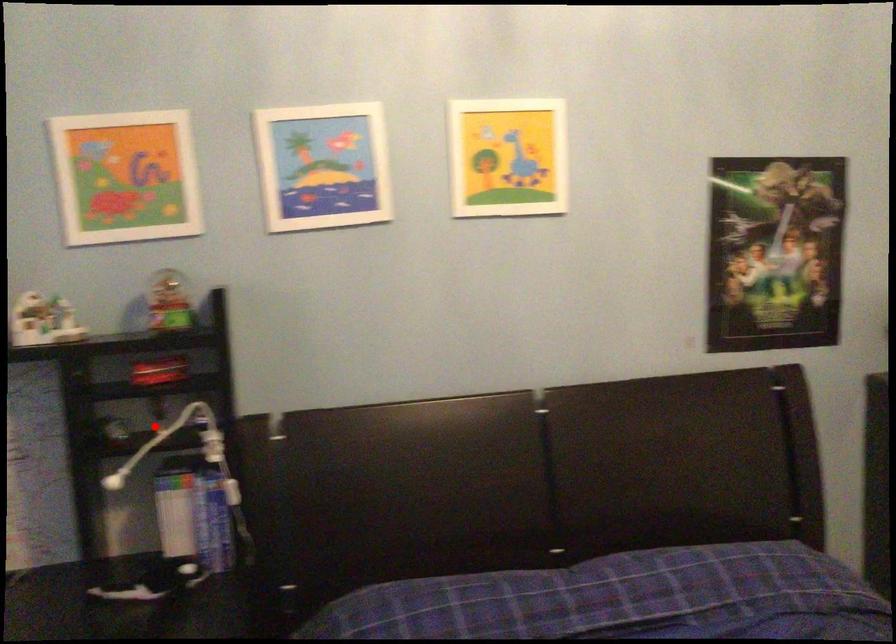
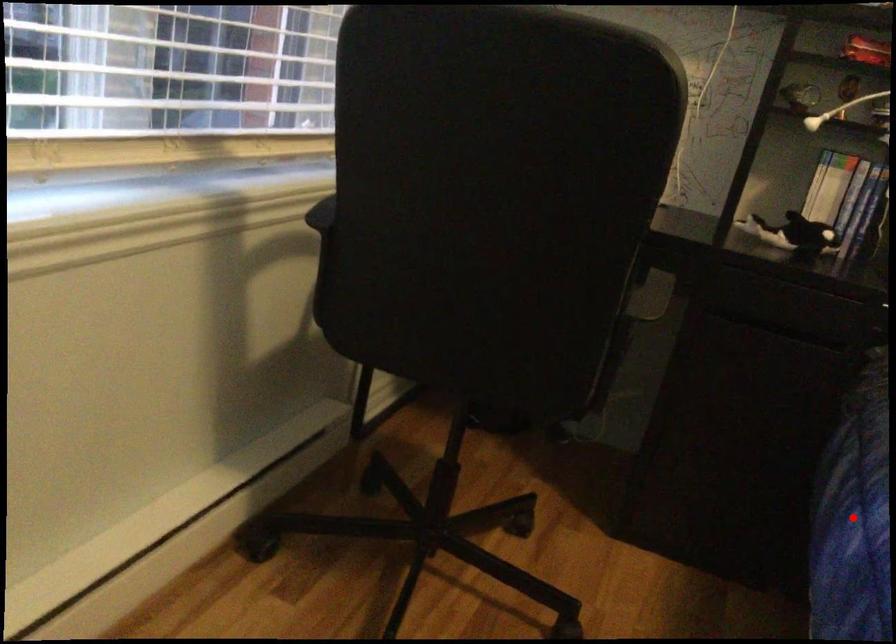
I am providing you with two images of the same scene from different viewpoints. A red point is marked on the first image and another point is marked on the second image. Does the point marked in image1 correspond to the same location as the one in image2?

No